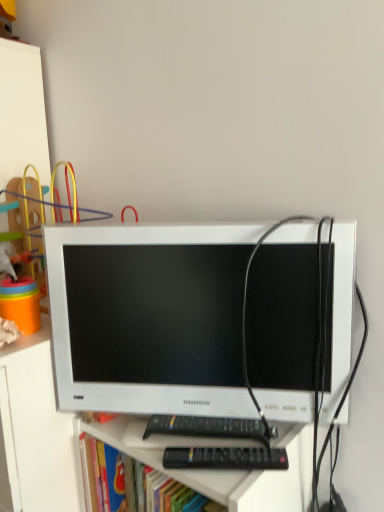
Question: Is white glossy computer monitor at center far from white matte file cabinet at left?

Choices:
 (A) no
 (B) yes

Answer: (A)

Question: Can you see white glossy computer monitor at center touching white matte file cabinet at left?

Choices:
 (A) yes
 (B) no

Answer: (B)

Question: Is the position of white glossy computer monitor at center more distant than that of white matte file cabinet at left?

Choices:
 (A) no
 (B) yes

Answer: (A)

Question: From the image's perspective, would you say white glossy computer monitor at center is shown under white matte file cabinet at left?

Choices:
 (A) no
 (B) yes

Answer: (A)

Question: Can you confirm if white glossy computer monitor at center is positioned to the left of white matte file cabinet at left?

Choices:
 (A) yes
 (B) no

Answer: (B)

Question: Would you say white glossy computer monitor at center is outside white matte file cabinet at left?

Choices:
 (A) no
 (B) yes

Answer: (B)

Question: Does black plastic remote at lower center have a lesser width compared to white matte file cabinet at left?

Choices:
 (A) yes
 (B) no

Answer: (A)

Question: Can white matte file cabinet at left be found inside black plastic remote at lower center?

Choices:
 (A) no
 (B) yes

Answer: (A)

Question: Can you confirm if black plastic remote at lower center is smaller than white matte file cabinet at left?

Choices:
 (A) no
 (B) yes

Answer: (B)

Question: Is black plastic remote at lower center beside white matte file cabinet at left?

Choices:
 (A) yes
 (B) no

Answer: (B)

Question: Considering the relative positions of black plastic remote at lower center and white matte file cabinet at left in the image provided, is black plastic remote at lower center to the right of white matte file cabinet at left from the viewer's perspective?

Choices:
 (A) yes
 (B) no

Answer: (A)

Question: Is black plastic remote at lower center facing towards white matte file cabinet at left?

Choices:
 (A) no
 (B) yes

Answer: (A)

Question: Is black plastic remote at lower center completely or partially outside of white glossy computer monitor at center?

Choices:
 (A) yes
 (B) no

Answer: (A)